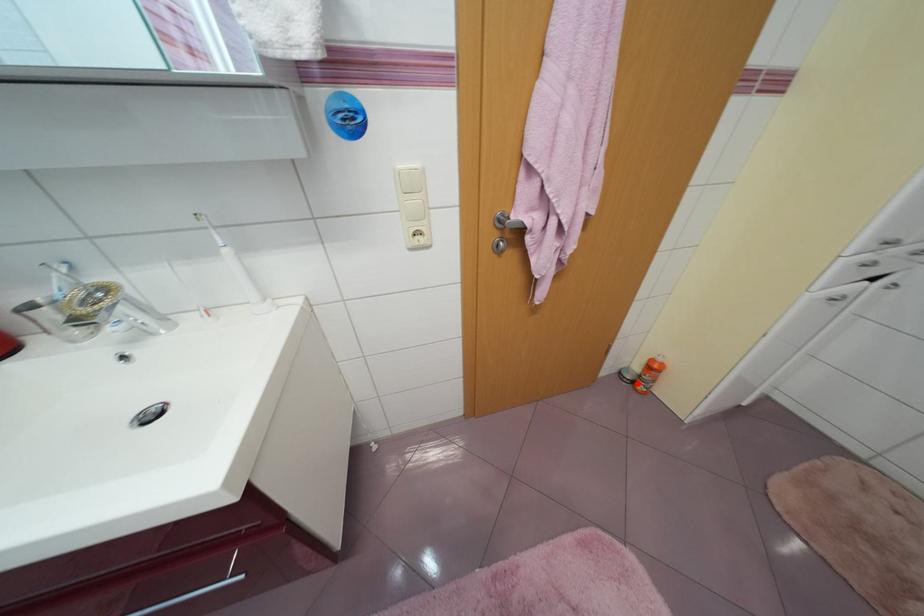
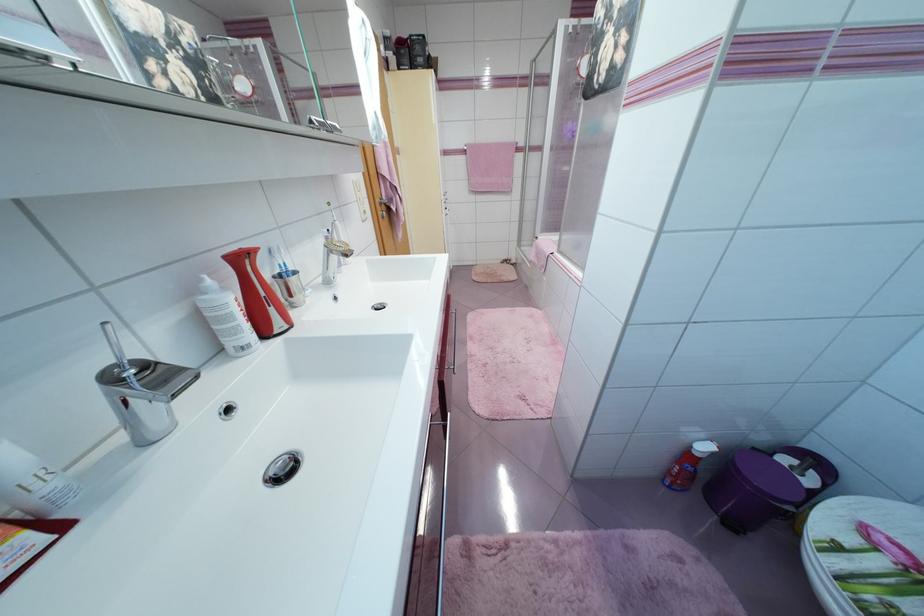
Question: I am providing you with two images of the same scene from different viewpoints. A red point is marked on the first image. Can you still see the location of the red point in image 2?

Choices:
 (A) Yes
 (B) No

Answer: (B)